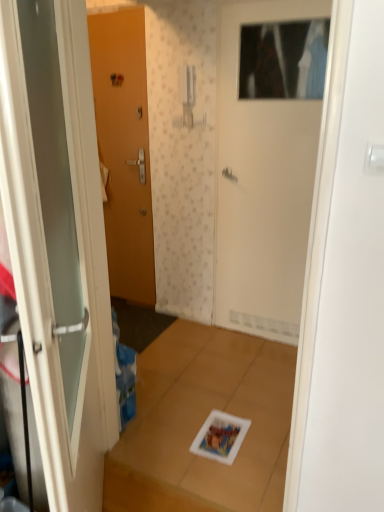
The height and width of the screenshot is (512, 384). Find the location of `blank space situated above matte wood door at left, which is the third door from front to back (from a real-world perspective)`. blank space situated above matte wood door at left, which is the third door from front to back (from a real-world perspective) is located at coordinates (113, 6).